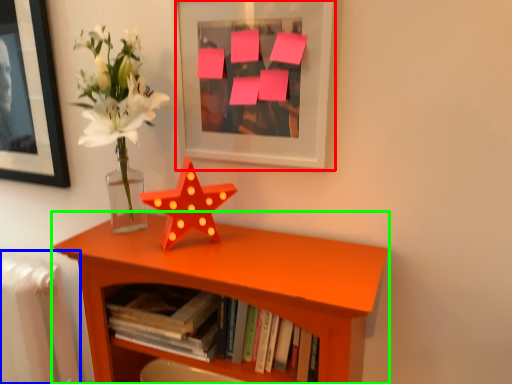
Question: Based on their relative distances, which object is nearer to picture frame (highlighted by a red box)? Choose from radiator (highlighted by a blue box) and shelf (highlighted by a green box).

Choices:
 (A) radiator
 (B) shelf

Answer: (B)